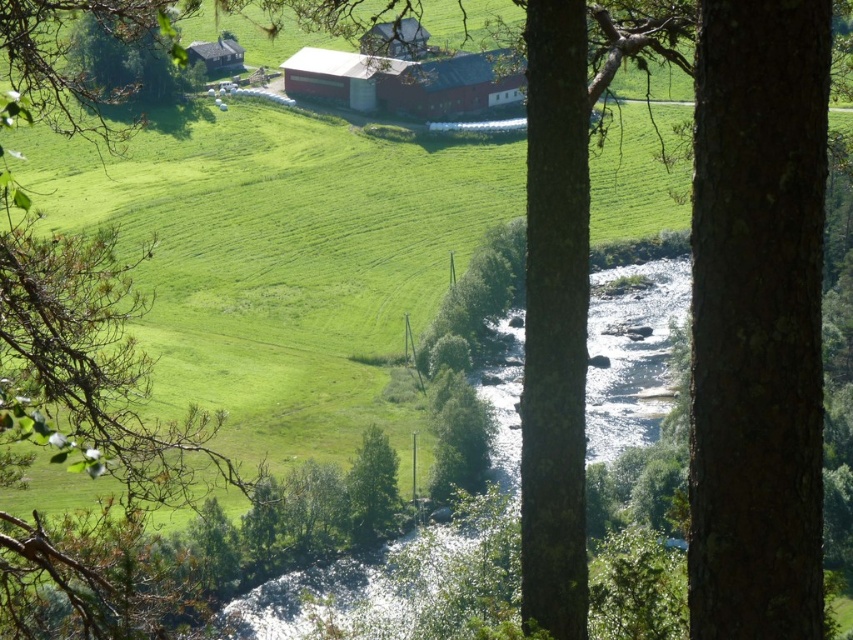
You are standing at the top of a hill overlooking a rural landscape. You notice two points marked on the image, one at coordinates point (x=424, y=90) and the other at point (x=195, y=42). Which point is closer to your current position?

Point (x=424, y=90) is closer to the camera than point (x=195, y=42), so the point at coordinates point (x=424, y=90) is closer to your current position.

In the scene shown: You are a farmer who wants to place a new scarecrow exactly between the red matte barn at center and the green leafy tree at center. Based on the scene, which object should the scarecrow be closer to?

The red matte barn at center is positioned on the right side of green leafy tree at center, so the scarecrow should be placed closer to the green leafy tree at center to be exactly between them.

Based on the scene description, where is the red matte barn at center located in terms of its 2D coordinates?

The red matte barn at center is located at the 2D coordinates point (x=405, y=81).